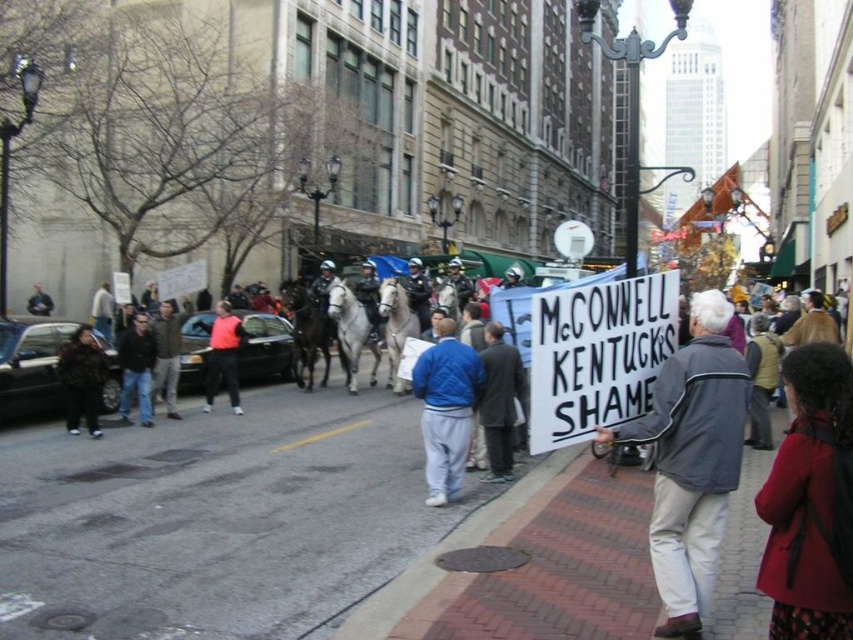
You are a protest organizer standing at the edge of the crowd. You need to place a new sign on the brick pavement at center. If your reach extends 4 meters, can you place the sign without moving closer?

The brick pavement at center is 5.01 meters away from the viewer, which is beyond your 4 meter reach. You cannot place the sign without moving closer.

You are a photographer trying to capture a photo of the dark blue jacket at center without the camouflage jacket at left appearing in the frame. Is it possible to do so given their positions?

The camouflage jacket at left is positioned under the dark blue jacket at center, meaning they are stacked vertically. Since they are not side by side, adjusting the camera angle to focus on the dark blue jacket at center while avoiding the lower positioned camouflage jacket at left should be feasible.

You are a photographer trying to capture a photo of the protest scene. You notice the camouflage jacket at left and the dark blue jacket at center. Which jacket should you focus on to ensure it takes up more space in your photo?

The camouflage jacket at left should be focused on because its width surpasses that of the dark blue jacket at center, making it appear larger in the photo.